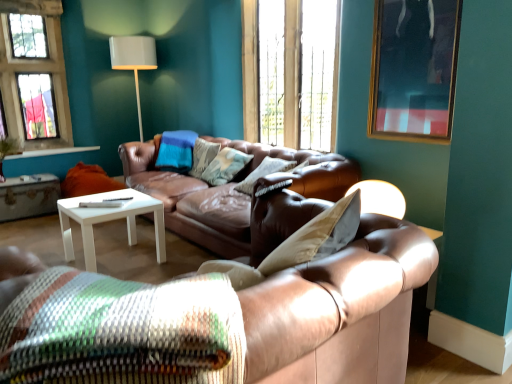
Question: Considering the relative sizes of glass pane window at upper left, the second window from the right, and textured brown pillow at center, which is the second pillow from back to front, in the image provided, is glass pane window at upper left, the second window from the right, smaller than textured brown pillow at center, which is the second pillow from back to front,?

Choices:
 (A) yes
 (B) no

Answer: (B)

Question: Can you confirm if glass pane window at upper left, the 1th window from the left, is positioned to the left of textured brown pillow at center, which is the second pillow from back to front?

Choices:
 (A) no
 (B) yes

Answer: (B)

Question: From the image's perspective, is glass pane window at upper left, the second window from the right, beneath textured brown pillow at center, arranged as the second pillow when viewed from the front?

Choices:
 (A) no
 (B) yes

Answer: (A)

Question: Is glass pane window at upper left, the second window from the right, not close to textured brown pillow at center, arranged as the second pillow when viewed from the front?

Choices:
 (A) yes
 (B) no

Answer: (A)

Question: Is glass pane window at upper left, the 1th window from the left, taller than textured brown pillow at center, which is the second pillow from back to front?

Choices:
 (A) no
 (B) yes

Answer: (B)

Question: In terms of width, does textured woven pillow at center, arranged as the 1th pillow when viewed from the front, look wider or thinner when compared to white matte coffee table at center?

Choices:
 (A) thin
 (B) wide

Answer: (B)

Question: From the image's perspective, relative to white matte coffee table at center, is textured woven pillow at center, arranged as the 1th pillow when viewed from the front, above or below?

Choices:
 (A) above
 (B) below

Answer: (B)

Question: Considering the relative positions of textured woven pillow at center, which is the third pillow from back to front, and white matte coffee table at center in the image provided, is textured woven pillow at center, which is the third pillow from back to front, to the left or to the right of white matte coffee table at center?

Choices:
 (A) right
 (B) left

Answer: (A)

Question: From a real-world perspective, is textured woven pillow at center, which is the third pillow from back to front, above or below white matte coffee table at center?

Choices:
 (A) above
 (B) below

Answer: (A)

Question: From the image's perspective, relative to wooden frame at upper center, positioned as the 2th window in left-to-right order, is white wood side table at lower left above or below?

Choices:
 (A) below
 (B) above

Answer: (A)

Question: Considering the positions of white wood side table at lower left and wooden frame at upper center, which is counted as the first window, starting from the right, in the image, is white wood side table at lower left taller or shorter than wooden frame at upper center, which is counted as the first window, starting from the right,?

Choices:
 (A) tall
 (B) short

Answer: (B)

Question: Is white wood side table at lower left wider or thinner than wooden frame at upper center, positioned as the 2th window in left-to-right order?

Choices:
 (A) wide
 (B) thin

Answer: (A)

Question: Is white wood side table at lower left inside or outside of wooden frame at upper center, positioned as the 2th window in left-to-right order?

Choices:
 (A) inside
 (B) outside

Answer: (B)

Question: From a real-world perspective, is textured beige pillow at center, the third pillow in the front-to-back sequence, positioned above or below white wood side table at lower left?

Choices:
 (A) above
 (B) below

Answer: (A)

Question: From the image's perspective, is textured beige pillow at center, the third pillow in the front-to-back sequence, located above or below white wood side table at lower left?

Choices:
 (A) above
 (B) below

Answer: (A)